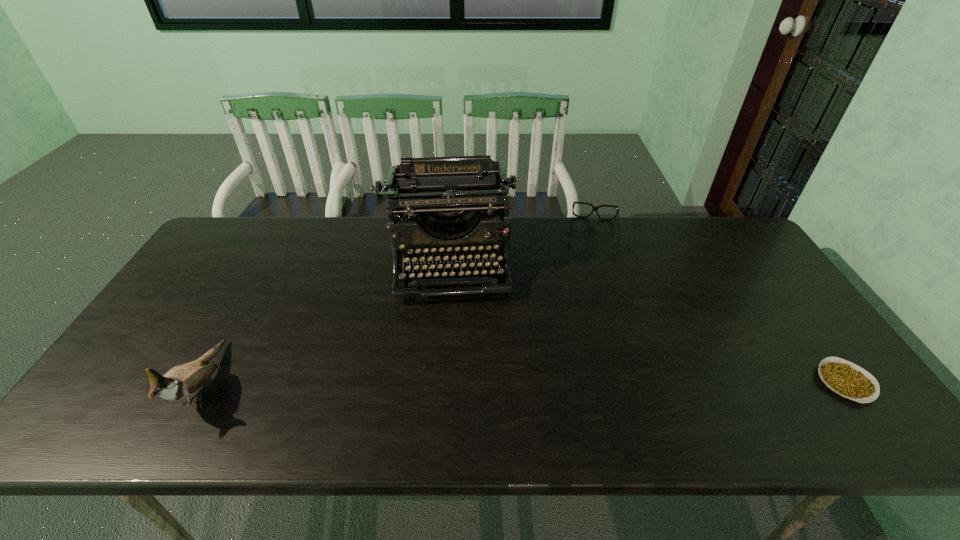
Image resolution: width=960 pixels, height=540 pixels. What are the coordinates of `free space located on the typing side of the third object from right to left` in the screenshot? It's located at tap(453, 384).

At what (x,y) coordinates should I click in order to perform the action: click on vacant area located 0.170m on the typing side of the third object from right to left. Please return your answer as a coordinate pair (x, y). This screenshot has width=960, height=540. Looking at the image, I should click on (452, 354).

The image size is (960, 540). I want to click on free spot located with the lenses facing outward on the spectacles, so click(x=592, y=331).

You are a GUI agent. You are given a task and a screenshot of the screen. Output one action in this format:
    pyautogui.click(x=<x>, y=<y>)
    Task: Click on the free point located with the lenses facing outward on the spectacles
    The width and height of the screenshot is (960, 540).
    Given the screenshot: What is the action you would take?
    pyautogui.click(x=593, y=271)

Image resolution: width=960 pixels, height=540 pixels. In order to click on vacant space situated 0.270m with the lenses facing outward on the spectacles in this screenshot , I will do `click(592, 315)`.

Identify the location of typewriter at the far edge. (448, 193).

The image size is (960, 540). I want to click on spectacles present at the far edge, so click(595, 208).

Where is `bird that is at the near edge`? The image size is (960, 540). bird that is at the near edge is located at coordinates tap(182, 381).

Locate an element on the screen. The image size is (960, 540). legume present at the near edge is located at coordinates (847, 379).

This screenshot has height=540, width=960. Identify the location of object situated at the right edge. (847, 379).